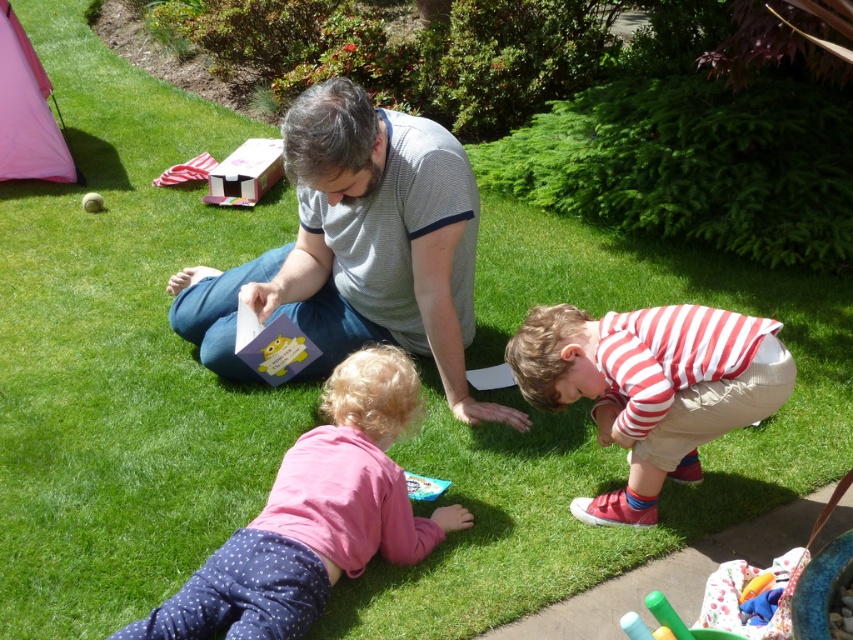
Question: Can you confirm if pink soft fabric toddler at lower left is positioned to the right of white rubber tennis ball at upper left?

Choices:
 (A) no
 (B) yes

Answer: (B)

Question: Observing the image, what is the correct spatial positioning of pink soft fabric toddler at lower left in reference to cardboard box at upper center?

Choices:
 (A) right
 (B) left

Answer: (A)

Question: Which of the following is the closest to the observer?

Choices:
 (A) (271, 168)
 (B) (335, 445)
 (C) (100, 204)
 (D) (717, 416)

Answer: (D)

Question: Which point appears closest to the camera in this image?

Choices:
 (A) (380, 371)
 (B) (268, 144)
 (C) (83, 202)
 (D) (770, 372)

Answer: (D)

Question: Which is farther from the gray striped shirt at center?

Choices:
 (A) striped cotton shirt at lower right
 (B) pink soft fabric toddler at lower left

Answer: (A)

Question: Can you confirm if cardboard box at upper center is smaller than plastic toy boat at lower center?

Choices:
 (A) yes
 (B) no

Answer: (B)